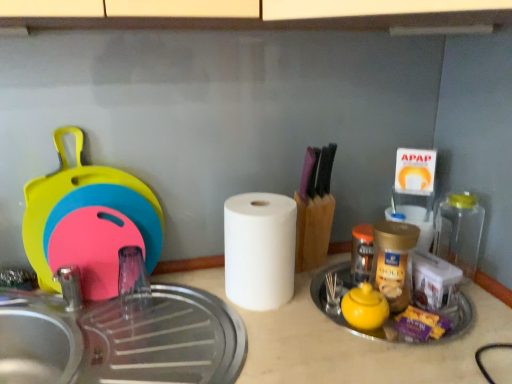
The image size is (512, 384). What are the coordinates of `vacant area that lies to the right of transparent plastic faucet at left` in the screenshot? It's located at tap(199, 313).